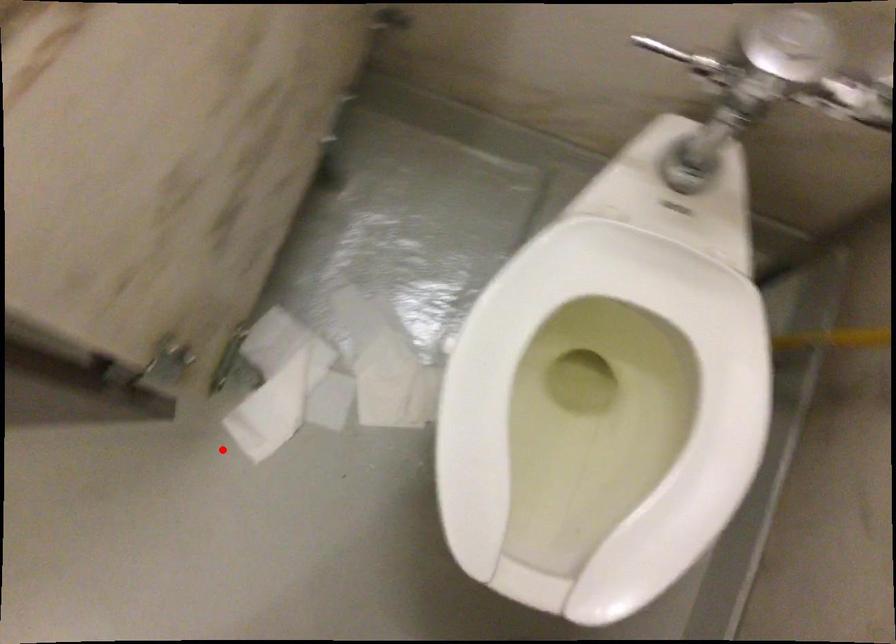
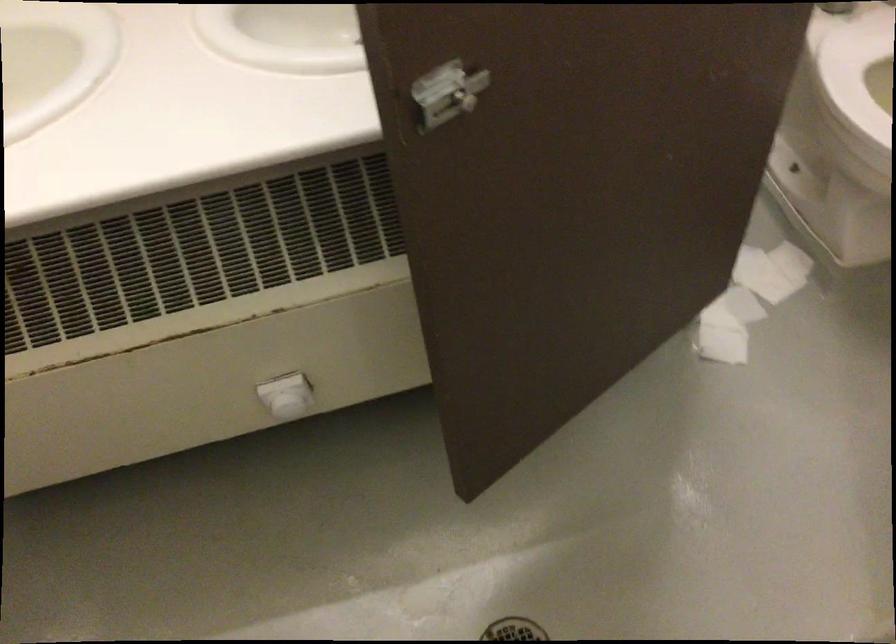
Where in the second image is the point corresponding to the highlighted location from the first image?

(721, 344)